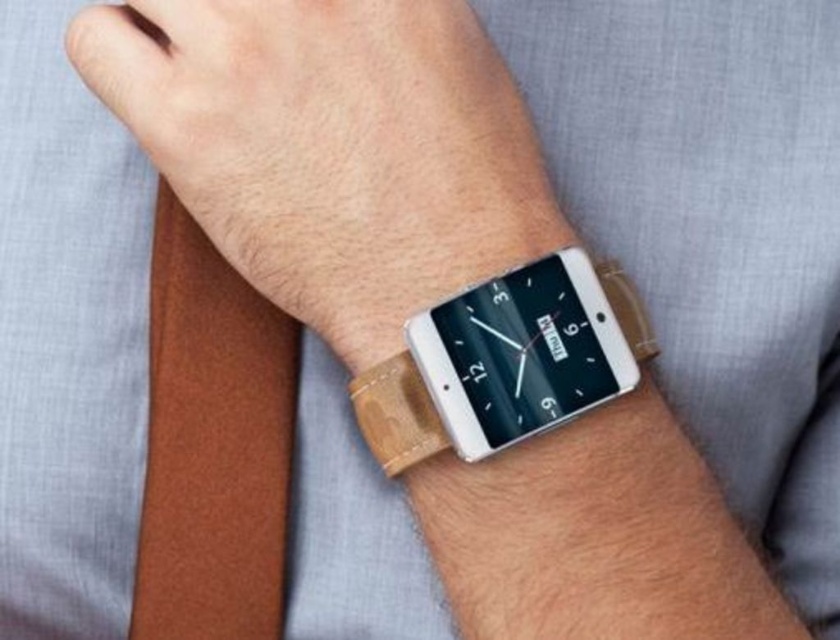
Who is higher up, brown leather tie at left or wooden at center?

wooden at center is higher up.

Who is lower down, brown leather tie at left or wooden at center?

brown leather tie at left is below.

Is point (218, 497) farther from camera compared to point (374, 372)?

Yes, point (218, 497) is farther from viewer.

Find the location of a particular element. The height and width of the screenshot is (640, 840). brown leather tie at left is located at coordinates (213, 444).

Is leather watch at center shorter than wooden at center?

In fact, leather watch at center may be taller than wooden at center.

Is point (387, 45) less distant than point (389, 380)?

No.

Measure the distance between leather watch at center and camera.

leather watch at center is 15.37 inches from camera.

Identify the location of leather watch at center. (331, 147).

Who is positioned more to the right, leather watch at center or wooden watch at center?

wooden watch at center is more to the right.

Looking at this image, is leather watch at center taller than wooden watch at center?

Indeed, leather watch at center has a greater height compared to wooden watch at center.

Is point (336, 166) positioned behind point (408, 362)?

Yes, it is behind point (408, 362).

Find the location of `leather watch at center`. leather watch at center is located at coordinates click(x=331, y=147).